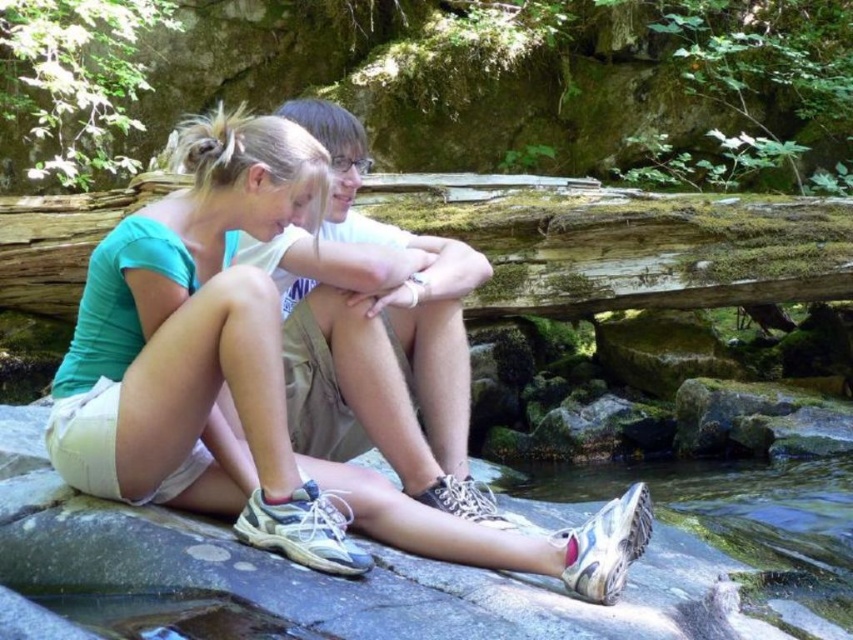
You are planning to place a small backpack on the weathered wood log at center. Can the log support the backpack without the backpack touching the white rubber shoe at lower center?

The weathered wood log at center is larger in size than the white rubber shoe at lower center, so there is enough space to place the backpack on the log without it touching the shoe.

You are a photographer trying to capture a closeup of the weathered wood log at center without the white rubber shoe at lower center blocking the view. Based on their positions, can you position yourself in a way to avoid the shoe?

The weathered wood log at center is in front of the white rubber shoe at lower center, so moving your camera position behind the log would allow you to capture the log without the shoe obstructing the view.

You are a hiker who wants to place your backpack on the weathered wood log at center. However, there is a white rubber shoe at lower center in the way. Can you move the backpack to the log without moving the shoe?

The weathered wood log at center is to the left of the white rubber shoe at lower center. Since the log is already positioned to the left of the shoe, you can place the backpack on the log without moving the shoe as they are separate objects.